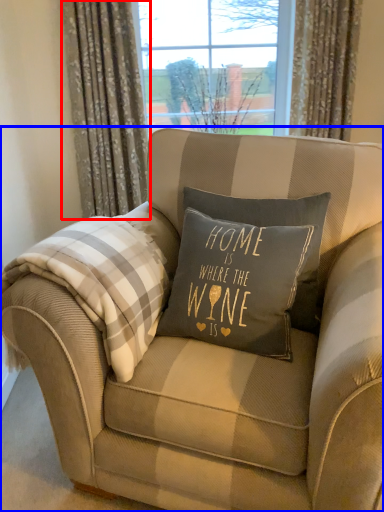
Question: Which object appears closest to the camera in this image, curtain (highlighted by a red box) or chair (highlighted by a blue box)?

Choices:
 (A) curtain
 (B) chair

Answer: (B)